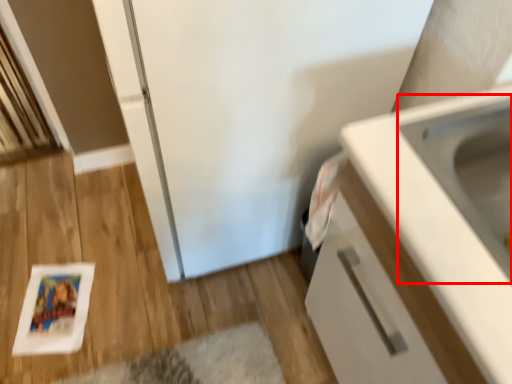
Question: Considering the relative positions of sink (annotated by the red box) and cabinetry in the image provided, where is sink (annotated by the red box) located with respect to the staircase?

Choices:
 (A) right
 (B) left

Answer: (B)